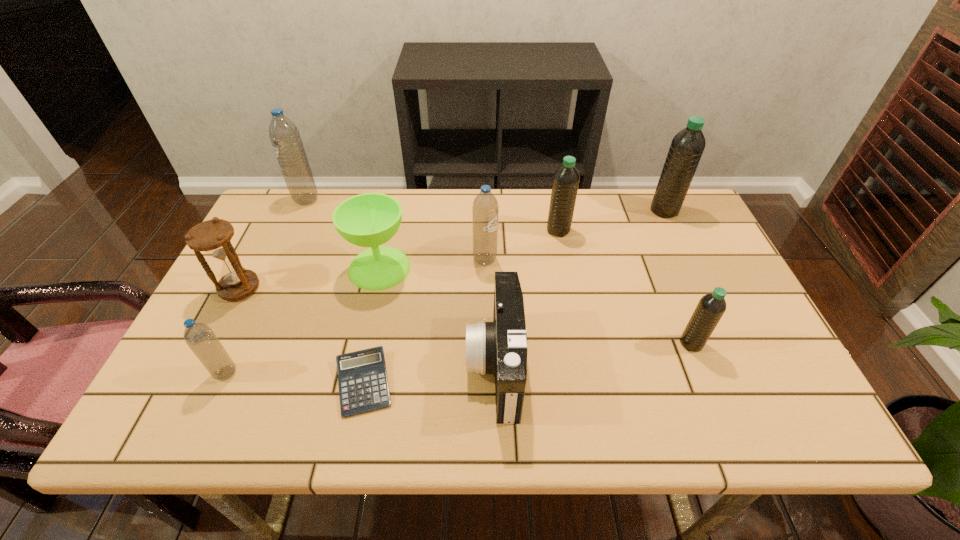
The image size is (960, 540). I want to click on object that is the closest to the shortest object, so click(x=500, y=347).

This screenshot has height=540, width=960. Identify the location of water bottle that stands as the fourth closest to the nearest water bottle. (711, 307).

Identify which water bottle is the fifth nearest to the calculator. Please provide its 2D coordinates. Your answer should be formatted as a tuple, i.e. [(x, y)], where the tuple contains the x and y coordinates of a point satisfying the conditions above.

[(711, 307)]

Where is `black water bottle that is the third closest to the calculator`? The width and height of the screenshot is (960, 540). black water bottle that is the third closest to the calculator is located at coordinates (687, 146).

Where is `black water bottle that is the nearest to the third farthest object`? The height and width of the screenshot is (540, 960). black water bottle that is the nearest to the third farthest object is located at coordinates (687, 146).

The image size is (960, 540). I want to click on blue water bottle identified as the second closest to the smallest blue water bottle, so click(485, 207).

Find the location of `the closest blue water bottle to the wineglass`. the closest blue water bottle to the wineglass is located at coordinates (485, 207).

Find the location of a particular element. Image resolution: width=960 pixels, height=540 pixels. free space that satisfies the following two spatial constraints: 1. on the back side of the hourglass; 2. on the left side of the green wineglass is located at coordinates (250, 268).

Image resolution: width=960 pixels, height=540 pixels. I want to click on free space that satisfies the following two spatial constraints: 1. on the front side of the biggest blue water bottle; 2. on the right side of the rightmost blue water bottle, so click(278, 260).

This screenshot has width=960, height=540. I want to click on vacant space that satisfies the following two spatial constraints: 1. on the front side of the fifth water bottle from left to right; 2. on the lens of the black camcorder, so tap(700, 366).